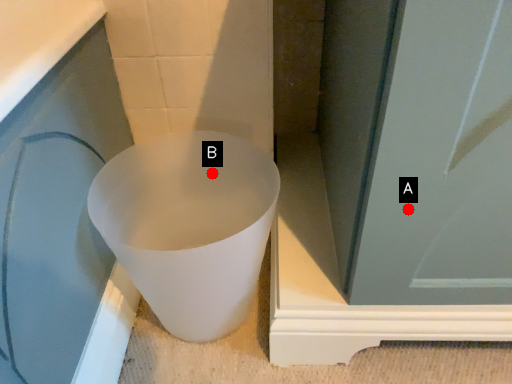
Question: Two points are circled on the image, labeled by A and B beside each circle. Which of the following is the farthest from the observer?

Choices:
 (A) A is further
 (B) B is further

Answer: (B)